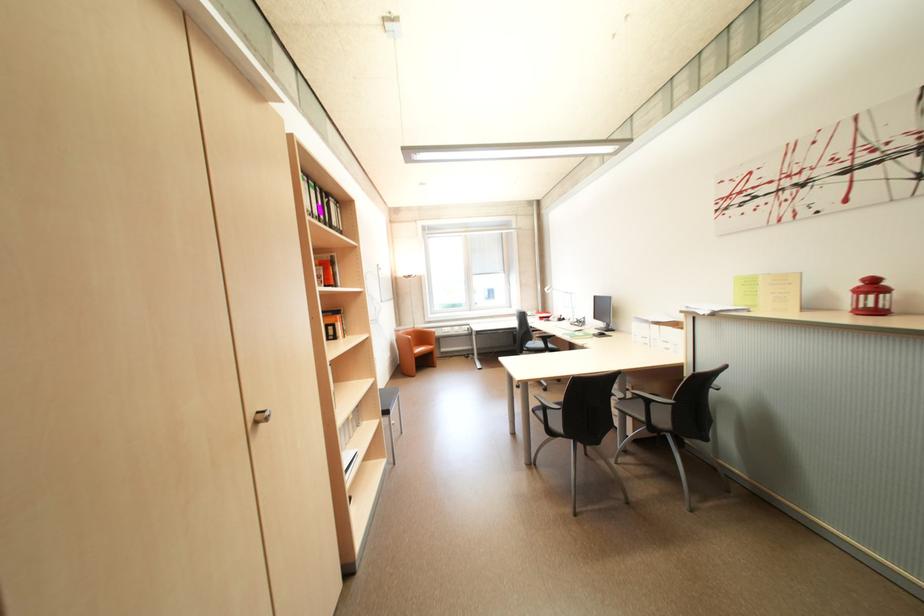
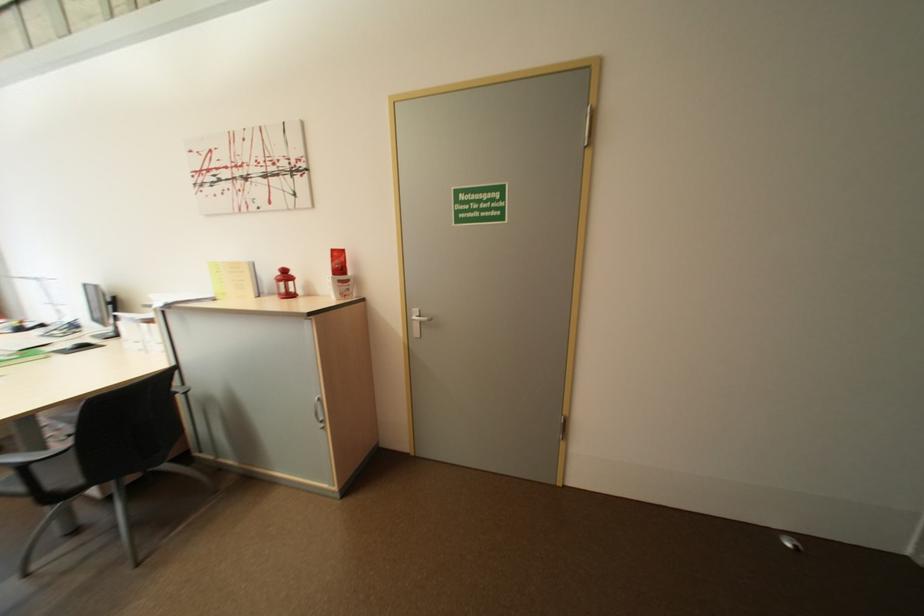
Locate, in the second image, the point that corresponds to pixel 869 294 in the first image.

(286, 282)